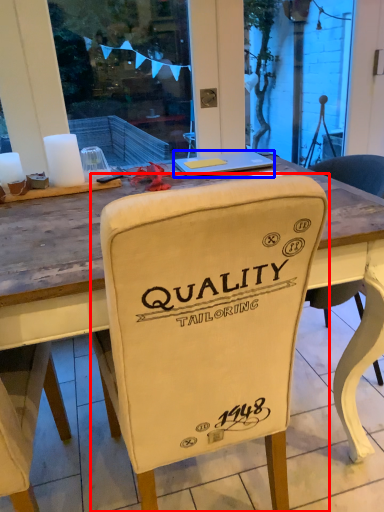
Question: Which point is further to the camera, chair (highlighted by a red box) or laptop (highlighted by a blue box)?

Choices:
 (A) chair
 (B) laptop

Answer: (B)